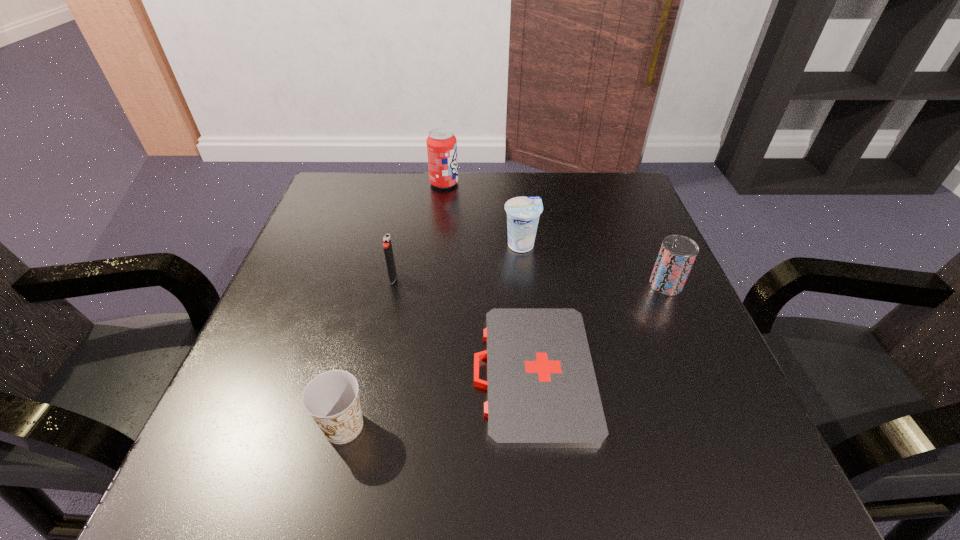
Identify the location of vacant point located 0.320m on the back of the rightmost object. (625, 192).

You are a GUI agent. You are given a task and a screenshot of the screen. Output one action in this format:
    pyautogui.click(x=<x>, y=<y>)
    Task: Click on the free location located 0.140m on the right of the Dixie cup
    
    Given the screenshot: What is the action you would take?
    pyautogui.click(x=460, y=426)

In order to click on vacant region located on handle side the first-aid kit in this screenshot , I will do `click(444, 373)`.

Identify the location of vacant space situated 0.300m on handle side the first-aid kit. (299, 373).

The height and width of the screenshot is (540, 960). What are the coordinates of `vacant space positioned 0.360m on handle side the first-aid kit` in the screenshot? It's located at (263, 373).

Where is `object at the far edge`? object at the far edge is located at coordinates (441, 143).

This screenshot has height=540, width=960. I want to click on Dixie cup present at the near edge, so click(332, 399).

I want to click on the first-aid kit located in the near edge section of the desktop, so click(x=542, y=390).

Find the location of `object at the left edge`. object at the left edge is located at coordinates (332, 399).

Find the location of a particular element. This screenshot has height=540, width=960. object that is at the right edge is located at coordinates (677, 254).